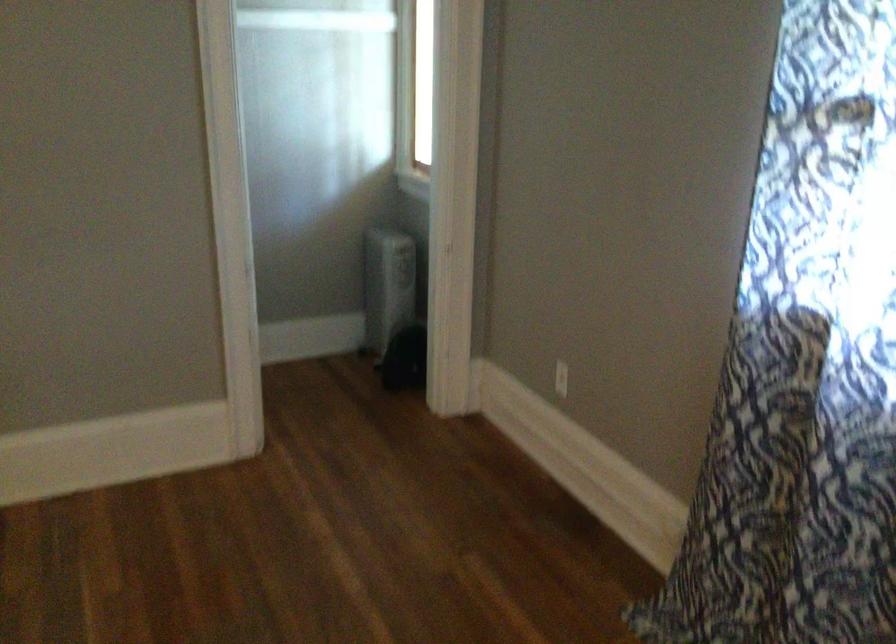
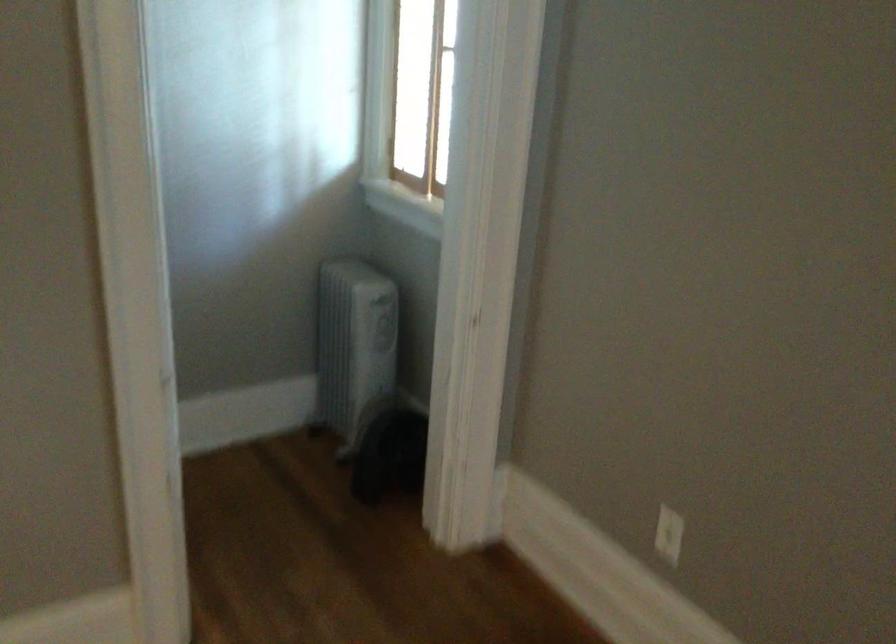
Question: Which direction would the cameraman need to move to produce the second image? Reply with the corresponding letter.

Choices:
 (A) Left
 (B) Right
 (C) Forward
 (D) Backward

Answer: (C)